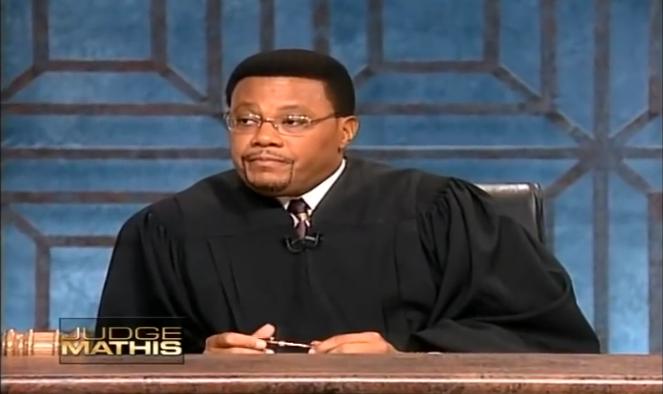
This screenshot has width=663, height=394. Find the location of `chair`. chair is located at coordinates (507, 198).